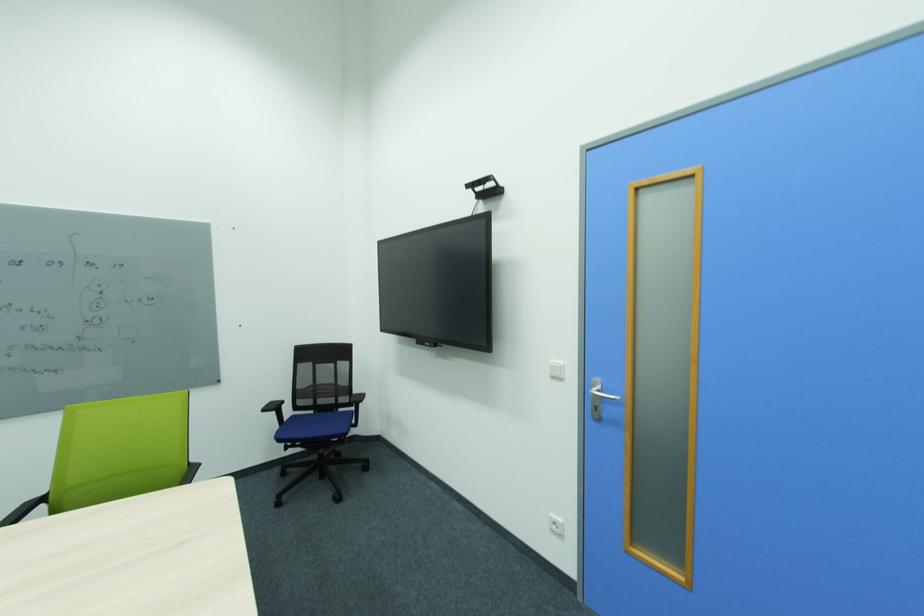
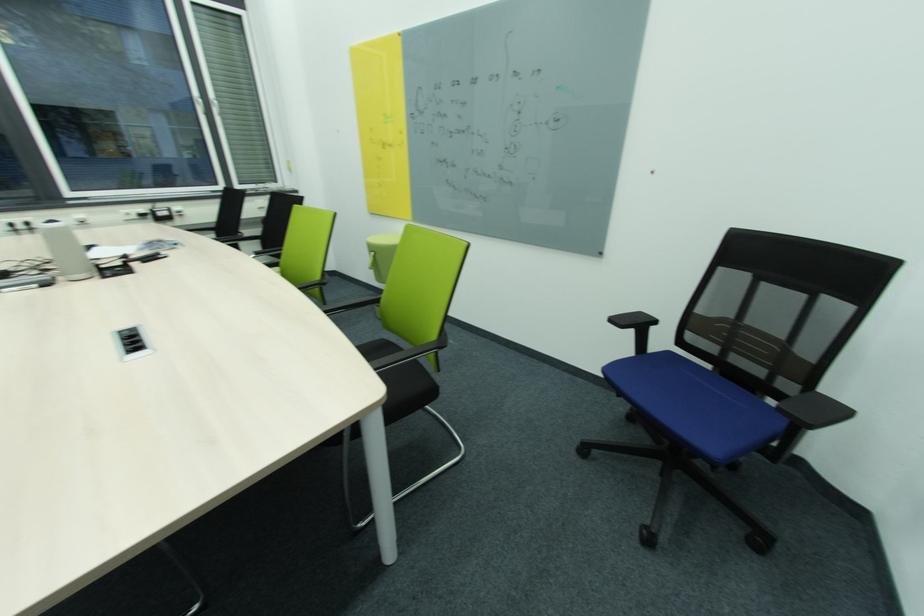
The point at (270,411) is marked in the first image. Where is the corresponding point in the second image?

(617, 321)